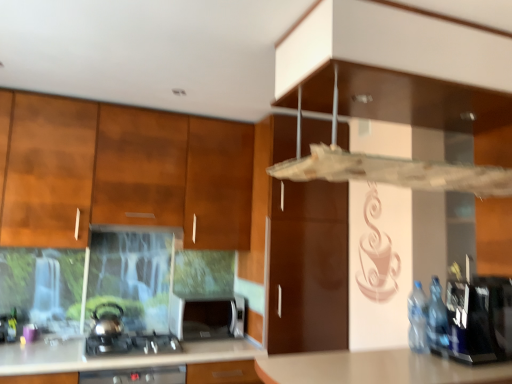
Question: Relative to wooden cabinet at left, is satin black gas stove at lower left in front or behind?

Choices:
 (A) front
 (B) behind

Answer: (A)

Question: Is satin black gas stove at lower left to the left or to the right of wooden cabinet at left in the image?

Choices:
 (A) left
 (B) right

Answer: (B)

Question: Estimate the real-world distances between objects in this image. Which object is farther from the satin silver kettle at lower left?

Choices:
 (A) white glossy countertop at lower left
 (B) blue plastic bottles at right
 (C) satin silver toaster at lower center
 (D) satin black gas stove at lower left
 (E) wooden cabinet at left

Answer: (B)

Question: Considering the real-world distances, which object is farthest from the satin silver toaster at lower center?

Choices:
 (A) wooden cabinet at left
 (B) satin black gas stove at lower left
 (C) satin silver kettle at lower left
 (D) transparent plastic vent at upper center
 (E) white glossy countertop at lower left

Answer: (D)